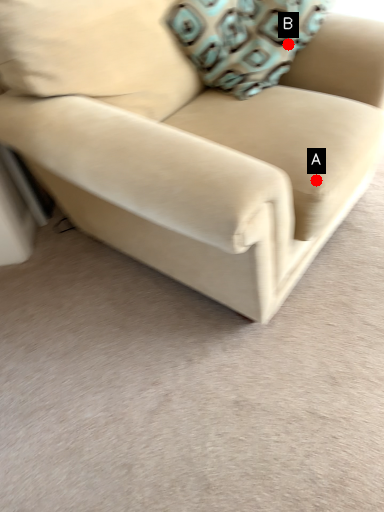
Question: Two points are circled on the image, labeled by A and B beside each circle. Which of the following is the farthest from the observer?

Choices:
 (A) A is further
 (B) B is further

Answer: (B)